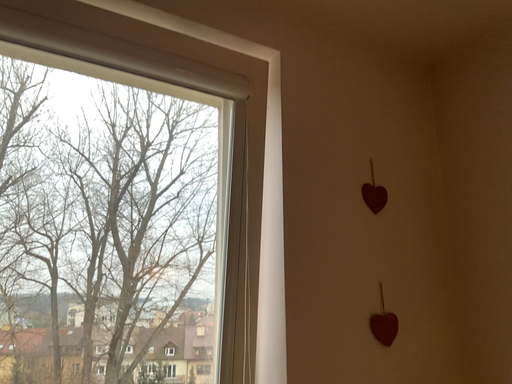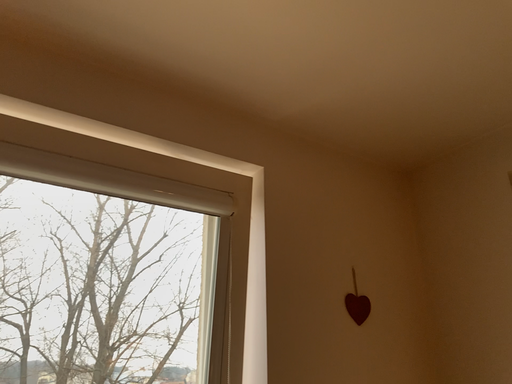
Question: Which way did the camera rotate in the video?

Choices:
 (A) rotated downward
 (B) rotated upward

Answer: (B)